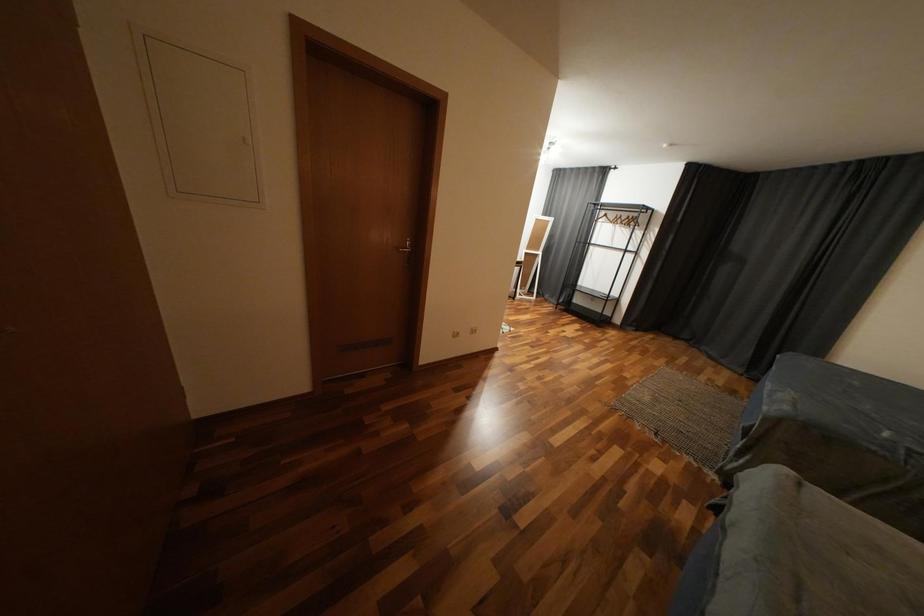
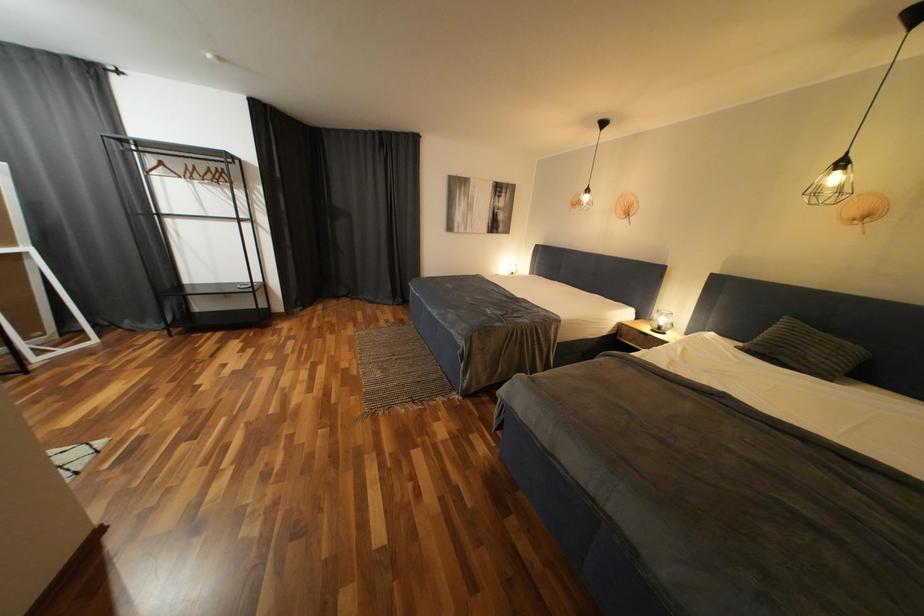
Based on the photo, the images are taken continuously from a first-person perspective. In which direction is your viewpoint rotating?

The camera's rotation is toward right-down.